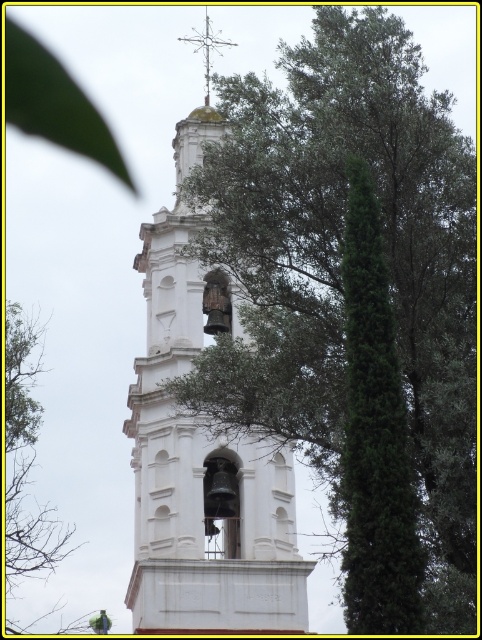
Question: Which point is closer to the camera taking this photo?

Choices:
 (A) (251, 609)
 (B) (205, 29)

Answer: (A)

Question: Can you confirm if green leafy tree at upper right is smaller than white stone bell tower at center?

Choices:
 (A) no
 (B) yes

Answer: (A)

Question: Considering the relative positions of green leafy tree at upper right and green leafy tree at upper left in the image provided, where is green leafy tree at upper right located with respect to green leafy tree at upper left?

Choices:
 (A) left
 (B) right

Answer: (B)

Question: Can you confirm if white stone bell tower at center is positioned to the left of polished metal cross at upper center?

Choices:
 (A) no
 (B) yes

Answer: (B)

Question: Which object appears closest to the camera in this image?

Choices:
 (A) white stone bell tower at center
 (B) green leafy tree at upper left

Answer: (A)

Question: Among these points, which one is farthest from the camera?

Choices:
 (A) (x=30, y=371)
 (B) (x=428, y=419)
 (C) (x=218, y=33)

Answer: (C)